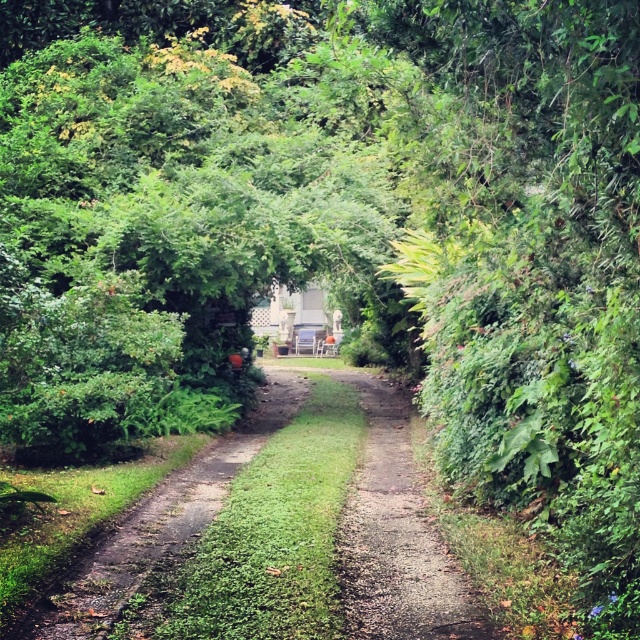
How distant is dirt path at center from green grassy trail at center?

They are 7.05 feet apart.

Is point (355, 524) closer to camera compared to point (113, 577)?

That is False.

In order to click on dirt path at center in this screenshot , I will do `click(397, 536)`.